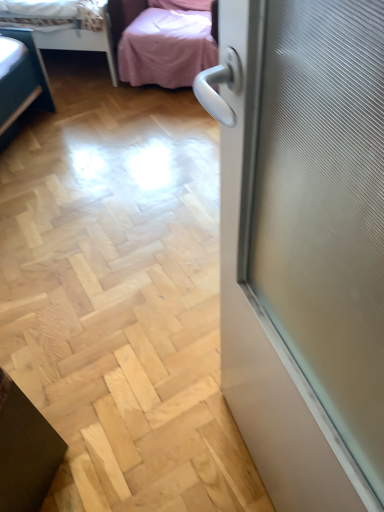
Where is `pink fabric studio couch at upper center`? This screenshot has width=384, height=512. pink fabric studio couch at upper center is located at coordinates (161, 42).

Describe the element at coordinates (161, 42) in the screenshot. I see `pink fabric studio couch at upper center` at that location.

Find the location of a particular element. The image size is (384, 512). pink fabric bed at upper left is located at coordinates pos(64,25).

This screenshot has width=384, height=512. What do you see at coordinates (64, 25) in the screenshot?
I see `pink fabric bed at upper left` at bounding box center [64, 25].

Based on the photo, what is the approximate height of pink fabric bed at upper left?

pink fabric bed at upper left is 21.36 inches tall.

Locate an element on the screen. pink fabric studio couch at upper center is located at coordinates (161, 42).

Is pink fabric bed at upper left to the left of pink fabric studio couch at upper center from the viewer's perspective?

Indeed, pink fabric bed at upper left is positioned on the left side of pink fabric studio couch at upper center.

Is pink fabric bed at upper left closer to camera compared to pink fabric studio couch at upper center?

No, it is behind pink fabric studio couch at upper center.

Considering the positions of points (86, 32) and (185, 35), is point (86, 32) closer to camera compared to point (185, 35)?

No, (86, 32) is further to viewer.

From the image's perspective, is pink fabric bed at upper left on pink fabric studio couch at upper center?

Yes, from the image's perspective, pink fabric bed at upper left is on top of pink fabric studio couch at upper center.

Based on the photo, from a real-world perspective, does pink fabric bed at upper left sit lower than pink fabric studio couch at upper center?

Yes.

Can you confirm if pink fabric bed at upper left is wider than pink fabric studio couch at upper center?

Yes.

Considering the sizes of objects pink fabric bed at upper left and pink fabric studio couch at upper center in the image provided, who is taller, pink fabric bed at upper left or pink fabric studio couch at upper center?

pink fabric studio couch at upper center is taller.

Is pink fabric bed at upper left bigger or smaller than pink fabric studio couch at upper center?

Clearly, pink fabric bed at upper left is larger in size than pink fabric studio couch at upper center.

Do you think pink fabric bed at upper left is within pink fabric studio couch at upper center, or outside of it?

pink fabric bed at upper left exists outside the volume of pink fabric studio couch at upper center.

Based on the photo, would you consider pink fabric bed at upper left to be distant from pink fabric studio couch at upper center?

No, pink fabric bed at upper left is not far away from pink fabric studio couch at upper center.

Is pink fabric bed at upper left aimed at pink fabric studio couch at upper center?

Yes, pink fabric bed at upper left faces towards pink fabric studio couch at upper center.

What's the angular difference between pink fabric bed at upper left and pink fabric studio couch at upper center's facing directions?

There is a 91.2-degree angle between the facing directions of pink fabric bed at upper left and pink fabric studio couch at upper center.

How distant is pink fabric bed at upper left from pink fabric studio couch at upper center?

The distance of pink fabric bed at upper left from pink fabric studio couch at upper center is 11.16 inches.

Identify the location of bed above the pink fabric studio couch at upper center (from the image's perspective). The image size is (384, 512). (64, 25).

Is pink fabric studio couch at upper center to the left of pink fabric bed at upper left from the viewer's perspective?

Incorrect, pink fabric studio couch at upper center is not on the left side of pink fabric bed at upper left.

Which object is more forward, pink fabric studio couch at upper center or pink fabric bed at upper left?

pink fabric studio couch at upper center.

Is point (204, 66) farther from viewer compared to point (91, 31)?

No, (204, 66) is closer to viewer.

From the image's perspective, is pink fabric studio couch at upper center positioned above or below pink fabric bed at upper left?

Based on their image positions, pink fabric studio couch at upper center is located beneath pink fabric bed at upper left.

From a real-world perspective, relative to pink fabric bed at upper left, is pink fabric studio couch at upper center vertically above or below?

In terms of real-world spatial position, pink fabric studio couch at upper center is above pink fabric bed at upper left.

Considering the relative sizes of pink fabric studio couch at upper center and pink fabric bed at upper left in the image provided, is pink fabric studio couch at upper center wider than pink fabric bed at upper left?

In fact, pink fabric studio couch at upper center might be narrower than pink fabric bed at upper left.

Who is shorter, pink fabric studio couch at upper center or pink fabric bed at upper left?

Standing shorter between the two is pink fabric bed at upper left.

Considering the relative sizes of pink fabric studio couch at upper center and pink fabric bed at upper left in the image provided, is pink fabric studio couch at upper center bigger than pink fabric bed at upper left?

Actually, pink fabric studio couch at upper center might be smaller than pink fabric bed at upper left.

Is pink fabric studio couch at upper center surrounding pink fabric bed at upper left?

No.

Is there a large distance between pink fabric studio couch at upper center and pink fabric bed at upper left?

No, pink fabric studio couch at upper center is not far away from pink fabric bed at upper left.

Is pink fabric bed at upper left at the back of pink fabric studio couch at upper center?

No, pink fabric studio couch at upper center's orientation is not away from pink fabric bed at upper left.

How much distance is there between pink fabric studio couch at upper center and pink fabric bed at upper left?

A distance of 11.16 inches exists between pink fabric studio couch at upper center and pink fabric bed at upper left.

You are a GUI agent. You are given a task and a screenshot of the screen. Output one action in this format:
    pyautogui.click(x=<x>, y=<y>)
    Task: Click on the bed below the pink fabric studio couch at upper center (from a real-world perspective)
    
    Given the screenshot: What is the action you would take?
    pyautogui.click(x=64, y=25)

The width and height of the screenshot is (384, 512). Identify the location of studio couch on the right of pink fabric bed at upper left. (161, 42).

Identify the location of bed above the pink fabric studio couch at upper center (from the image's perspective). (64, 25).